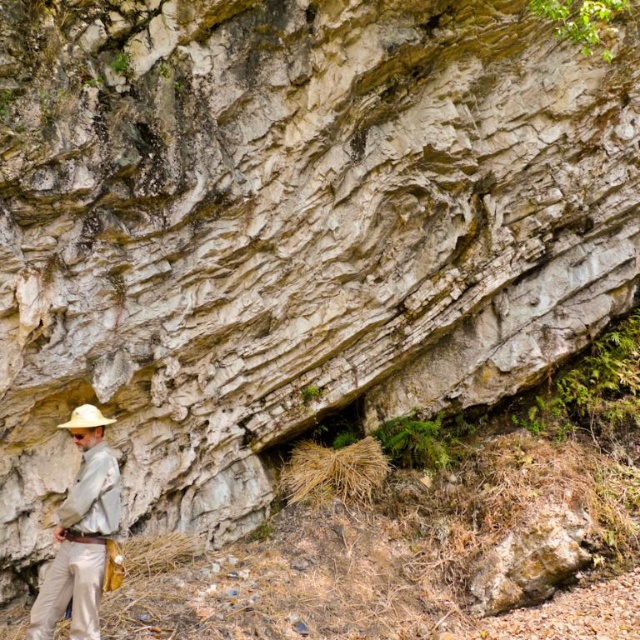
From the picture: Can you confirm if khaki cotton pants at lower left is positioned to the right of white matte cowboy hat at lower left?

Correct, you'll find khaki cotton pants at lower left to the right of white matte cowboy hat at lower left.

Is point (96, 611) behind point (112, 420)?

That is False.

Where is `khaki cotton pants at lower left`? Image resolution: width=640 pixels, height=640 pixels. khaki cotton pants at lower left is located at coordinates (81, 532).

Identify the location of khaki cotton pants at lower left. [x=81, y=532].